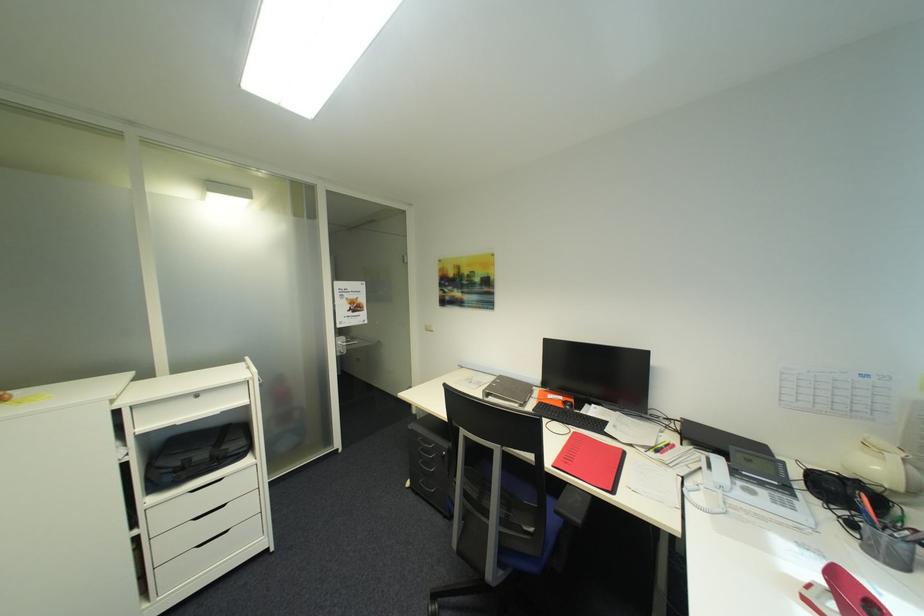
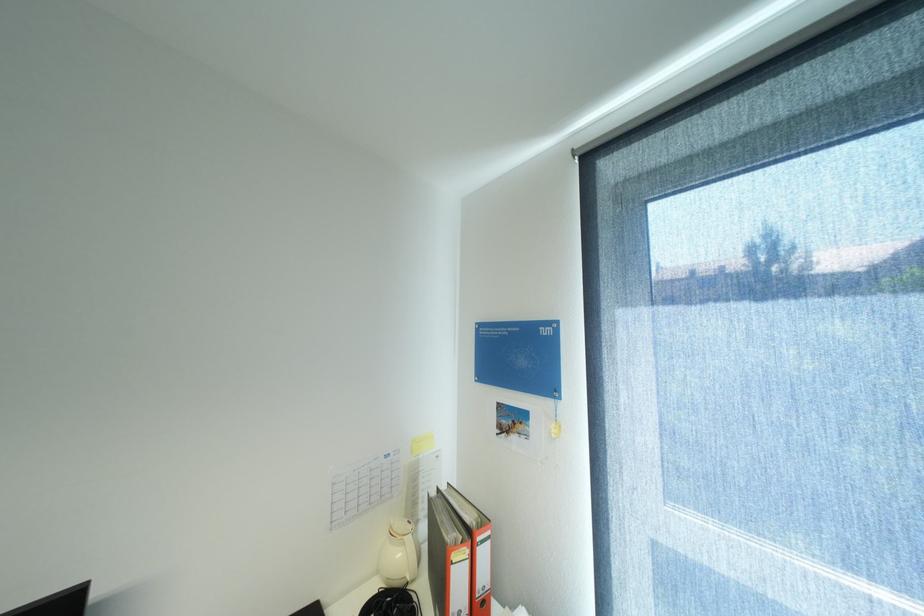
Locate, in the second image, the point that corresponds to point 886,469 in the first image.

(407, 554)